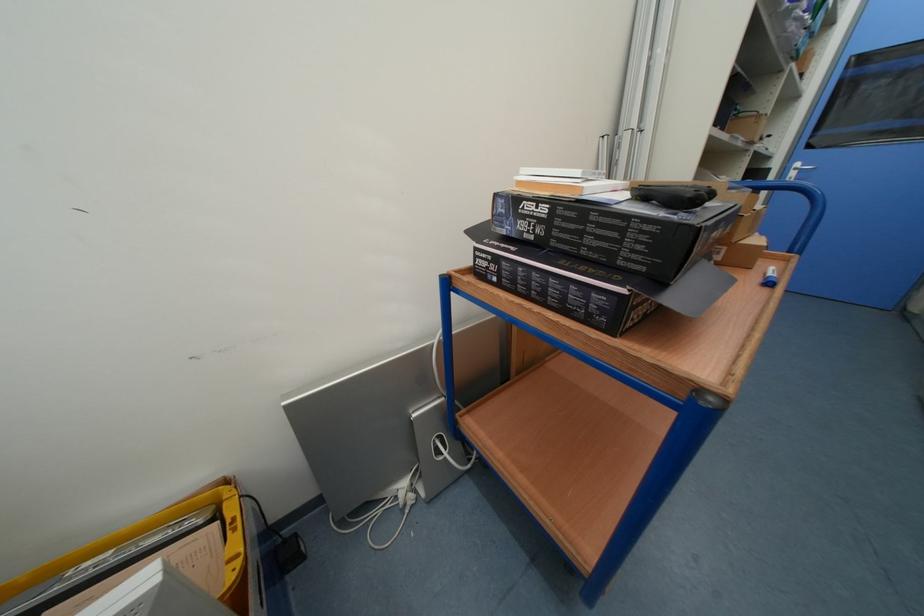
The location [564,172] corresponds to which object?

It corresponds to the white book in the image.